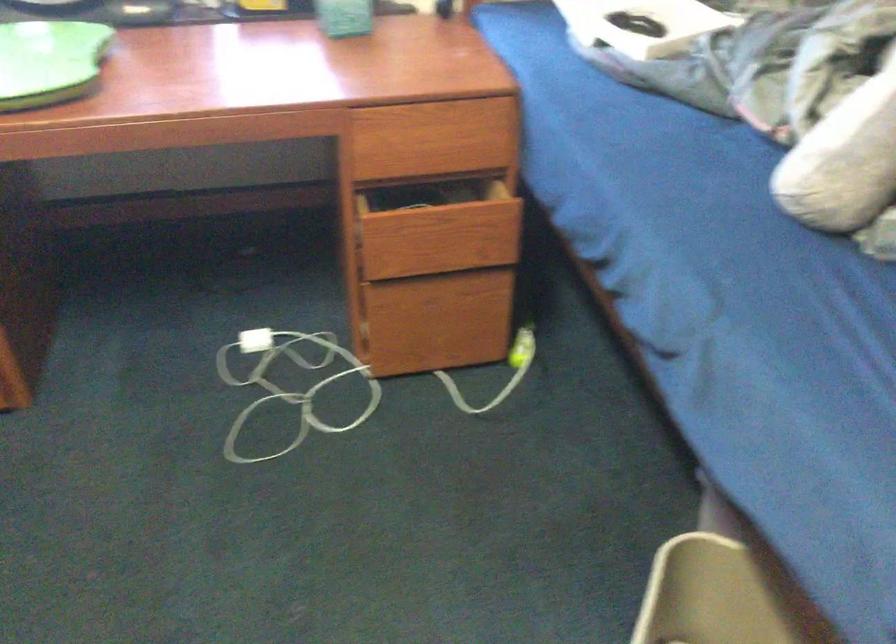
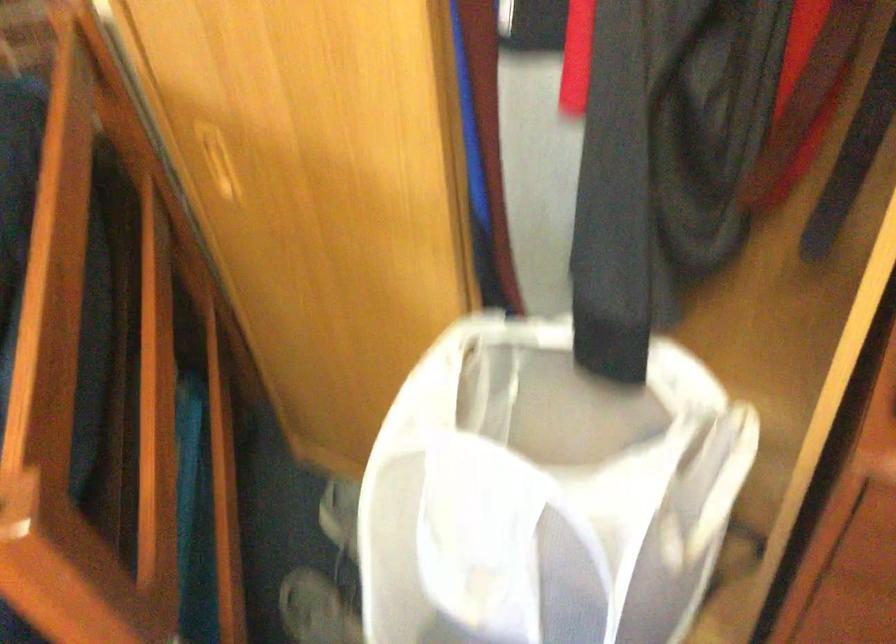
Based on the continuous images, in which direction is the camera rotating?

The camera rotated toward right-down.